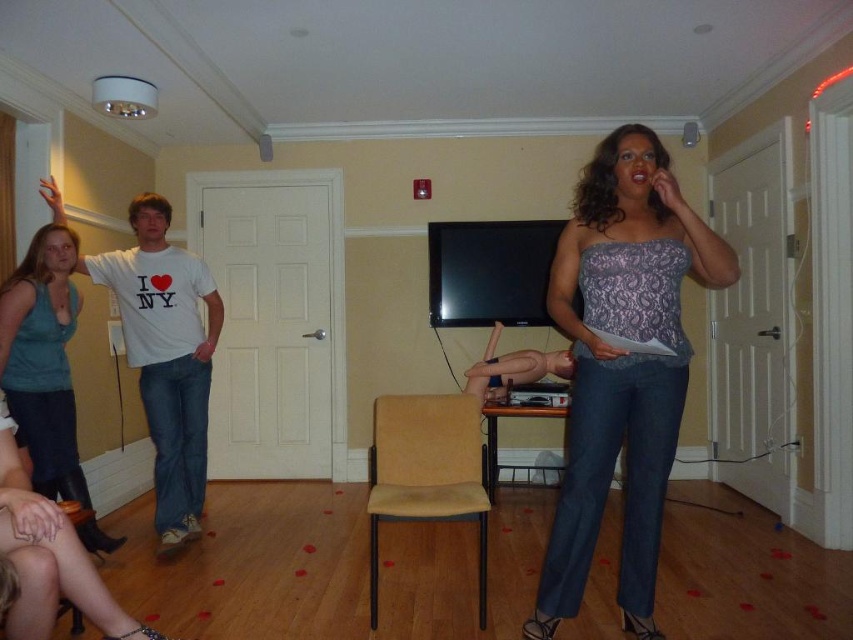
You are a photographer at the event and need to capture a photo where both the lace fabric top at center and the teal matte tank top at left are visible. Based on their positions, which one should you focus on first to ensure both are in frame?

The lace fabric top at center is located above the teal matte tank top at left, so focusing on the lace fabric top at center first will allow the photographer to frame the lower teal matte tank top at left within the same shot.